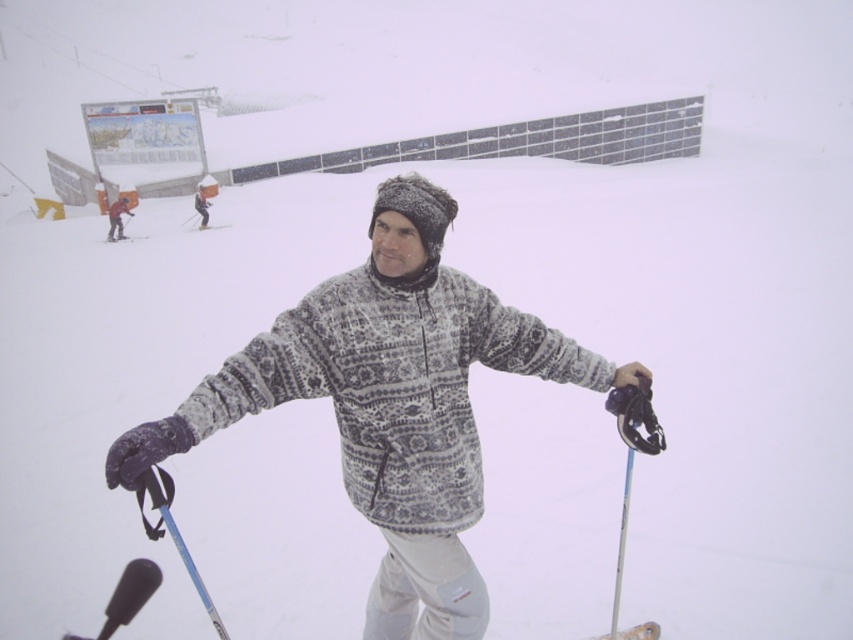
You are a photographer trying to capture a closeup of the black matte ski at upper left and the white plastic ski at upper center. Since you want both skis to be in focus, which one should you focus on first to ensure the other is also in focus?

The black matte ski at upper left is bigger than the white plastic ski at upper center, so you should focus on the black matte ski at upper left first to ensure both are in focus.

You are a photographer trying to capture the patterned fleece jacket at center and the blue plastic ski pole at lower left in a single shot. Based on their positions, can you tell which object is easier to focus on?

The patterned fleece jacket at center is closer to the viewer than the blue plastic ski pole at lower left, so it will be easier to focus on the patterned fleece jacket at center because it is nearer.